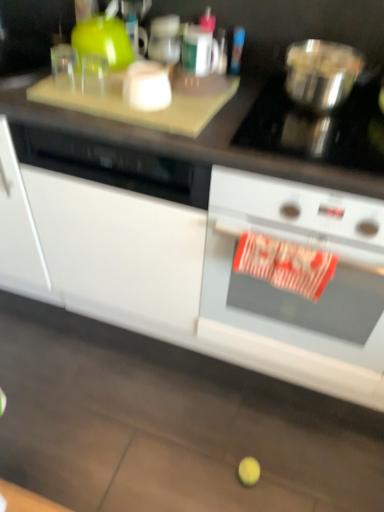
This screenshot has width=384, height=512. Describe the element at coordinates (321, 73) in the screenshot. I see `metallic silver bowl at upper right` at that location.

Identify the location of metallic silver bowl at upper right. The image size is (384, 512). (321, 73).

Can you see white matte cabinet at lower center touching white glossy oven at right?

They are not placed beside each other.

From a real-world perspective, which is physically above, white matte cabinet at lower center or white glossy oven at right?

From a 3D spatial view, white matte cabinet at lower center is above.

Is white matte cabinet at lower center to the left or to the right of white glossy oven at right in the image?

Clearly, white matte cabinet at lower center is on the left of white glossy oven at right in the image.

Would you say white glossy oven at right is part of white matte cabinet at lower center's contents?

That's correct, white glossy oven at right is inside white matte cabinet at lower center.

Is white glossy oven at right shorter than metallic silver bowl at upper right?

Incorrect, the height of white glossy oven at right does not fall short of that of metallic silver bowl at upper right.

Considering the relative sizes of white glossy oven at right and metallic silver bowl at upper right in the image provided, is white glossy oven at right thinner than metallic silver bowl at upper right?

Incorrect, the width of white glossy oven at right is not less than that of metallic silver bowl at upper right.

Considering the relative positions of white glossy oven at right and metallic silver bowl at upper right in the image provided, is white glossy oven at right behind metallic silver bowl at upper right?

No, the depth of white glossy oven at right is less than that of metallic silver bowl at upper right.

From the image's perspective, is white glossy oven at right positioned above or below metallic silver bowl at upper right?

white glossy oven at right is situated lower than metallic silver bowl at upper right in the image.

From a real-world perspective, which is physically below, white glossy oven at right or white matte cabinet at lower center?

In real-world perspective, white glossy oven at right is lower.

Between white glossy oven at right and white matte cabinet at lower center, which one has larger size?

Bigger between the two is white matte cabinet at lower center.

This screenshot has width=384, height=512. In the image, there is a white matte cabinet at lower center. Identify the location of kitchen appliance below it (from the image's perspective). point(290,240).

Are white matte cabinet at lower center and metallic silver bowl at upper right beside each other?

No, white matte cabinet at lower center is not next to metallic silver bowl at upper right.

Which is more distant, (x=193, y=231) or (x=319, y=90)?

The point (x=193, y=231) is farther.

Identify the location of cabinetry in front of the metallic silver bowl at upper right. (149, 276).

How distant is metallic silver bowl at upper right from white glossy oven at right?

metallic silver bowl at upper right is 17.89 inches from white glossy oven at right.

Which object is wider, metallic silver bowl at upper right or white glossy oven at right?

With larger width is white glossy oven at right.

In the scene shown: From a real-world perspective, is metallic silver bowl at upper right located beneath white glossy oven at right?

No, from a real-world perspective, metallic silver bowl at upper right is not beneath white glossy oven at right.

Which is behind, point (356, 70) or point (217, 237)?

The point (217, 237) is behind.

Between metallic silver bowl at upper right and white matte cabinet at lower center, which one has smaller size?

metallic silver bowl at upper right is smaller.

Does metallic silver bowl at upper right have a greater height compared to white matte cabinet at lower center?

In fact, metallic silver bowl at upper right may be shorter than white matte cabinet at lower center.

Could you tell me if metallic silver bowl at upper right is turned towards white matte cabinet at lower center?

No.

You are a GUI agent. You are given a task and a screenshot of the screen. Output one action in this format:
    pyautogui.click(x=<x>, y=<y>)
    Task: Click on the kitchen appliance below the white matte cabinet at lower center (from the image's perspective)
    The width and height of the screenshot is (384, 512).
    Given the screenshot: What is the action you would take?
    pyautogui.click(x=290, y=240)

Locate an element on the screen. This screenshot has height=512, width=384. bowl that appears on the left of white glossy oven at right is located at coordinates (321, 73).

Which object lies nearer to the anchor point white glossy oven at right, metallic silver bowl at upper right or white matte cabinet at lower center?

white matte cabinet at lower center is closer to white glossy oven at right.

From the image, which object appears to be farther from white matte cabinet at lower center, white glossy oven at right or metallic silver bowl at upper right?

metallic silver bowl at upper right is further to white matte cabinet at lower center.

When comparing their distances from metallic silver bowl at upper right, does white glossy oven at right or white matte cabinet at lower center seem closer?

white glossy oven at right is closer to metallic silver bowl at upper right.

Which object lies further to the anchor point white glossy oven at right, white matte cabinet at lower center or metallic silver bowl at upper right?

metallic silver bowl at upper right is positioned further to the anchor white glossy oven at right.

From the image, which object appears to be nearer to metallic silver bowl at upper right, white matte cabinet at lower center or white glossy oven at right?

white glossy oven at right is closer to metallic silver bowl at upper right.

Estimate the real-world distances between objects in this image. Which object is closer to white matte cabinet at lower center, metallic silver bowl at upper right or white glossy oven at right?

white glossy oven at right lies closer to white matte cabinet at lower center than the other object.

The height and width of the screenshot is (512, 384). In order to click on bowl between white matte cabinet at lower center and white glossy oven at right in this screenshot , I will do pyautogui.click(x=321, y=73).